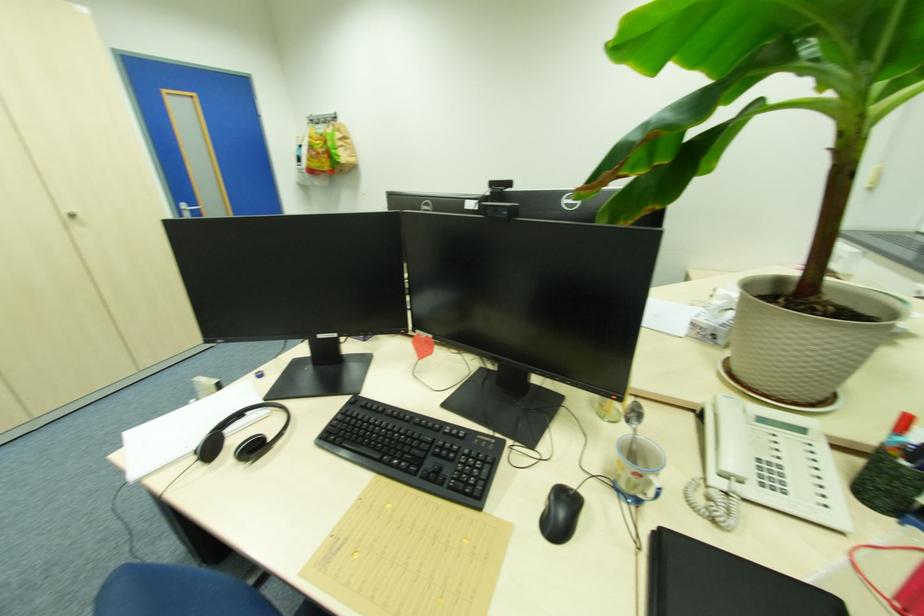
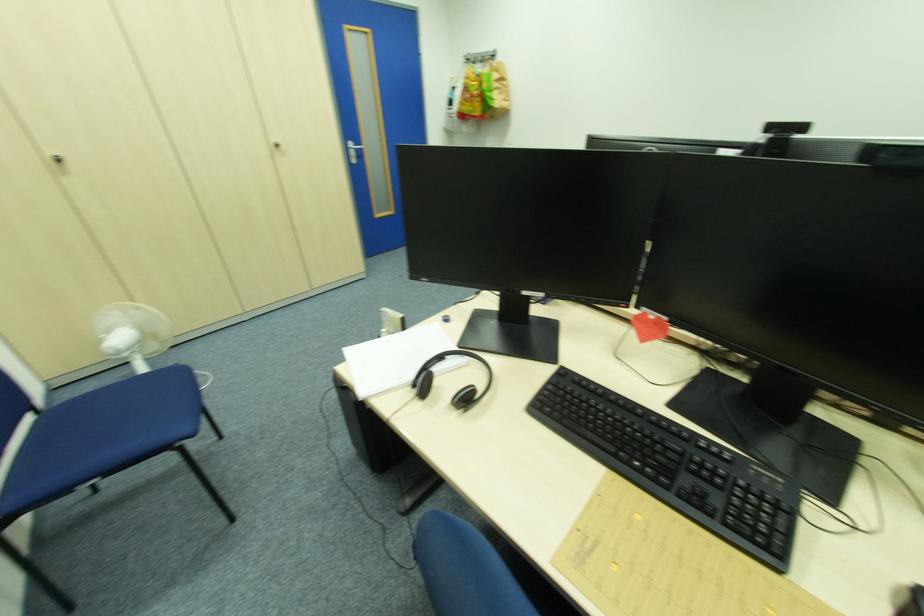
Question: The images are taken continuously from a first-person perspective. In which direction is your viewpoint rotating?

Choices:
 (A) Left
 (B) Right
 (C) Up
 (D) Down

Answer: (A)